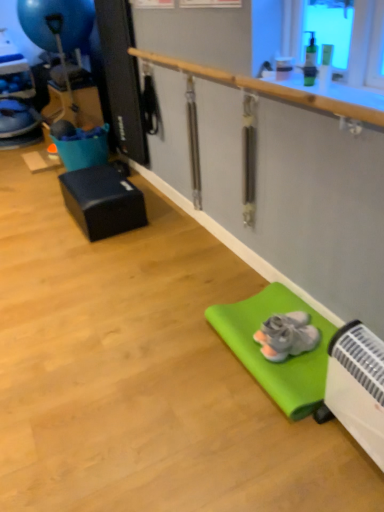
Where is `vacant space to the left of green rubber yoga mat at lower right`? vacant space to the left of green rubber yoga mat at lower right is located at coordinates (173, 377).